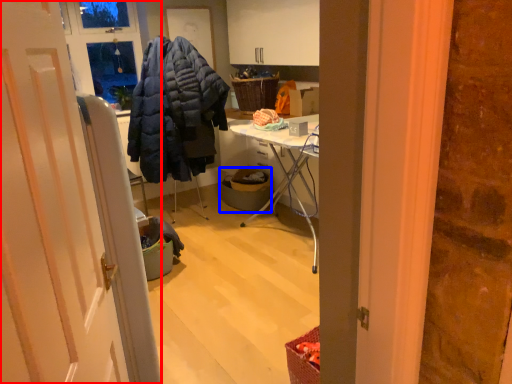
Question: Which object is further to the camera taking this photo, door (highlighted by a red box) or trash bin/can (highlighted by a blue box)?

Choices:
 (A) door
 (B) trash bin/can

Answer: (B)